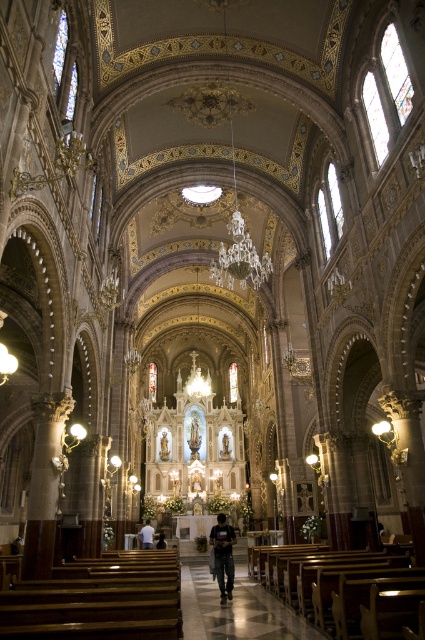
Is point (305, 625) closer to camera compared to point (150, 528)?

That is True.

Does wooden polished aisle at center appear under white fabric shirt at center?

Actually, wooden polished aisle at center is above white fabric shirt at center.

You are a GUI agent. You are given a task and a screenshot of the screen. Output one action in this format:
    pyautogui.click(x=<x>, y=<y>)
    Task: Click on the wooden polished aisle at center
    
    Given the screenshot: What is the action you would take?
    pyautogui.click(x=235, y=605)

Who is lower down, wooden polished aisle at center or black cotton shirt at center?

black cotton shirt at center is below.

Is point (251, 584) closer to camera compared to point (220, 547)?

No, (251, 584) is behind (220, 547).

In order to click on wooden polished aisle at center in this screenshot , I will do `click(235, 605)`.

Measure the distance between black cotton shirt at center and white fabric shirt at center.

black cotton shirt at center and white fabric shirt at center are 95.18 feet apart.

Does point (212, 532) come closer to viewer compared to point (141, 536)?

Yes.

Who is more forward, (232, 566) or (141, 540)?

Positioned in front is point (232, 566).

The height and width of the screenshot is (640, 425). Find the location of `black cotton shirt at center`. black cotton shirt at center is located at coordinates (223, 554).